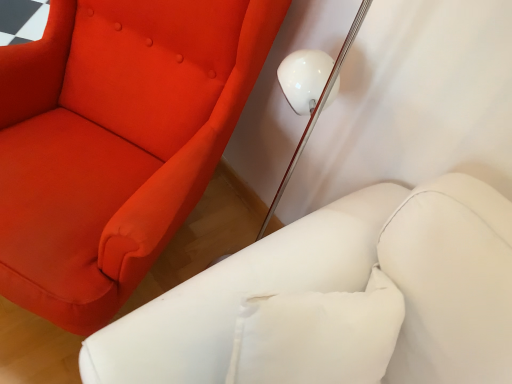
Question: Is matte red fabric chair at upper left taller or shorter than white leather armchair at lower right?

Choices:
 (A) short
 (B) tall

Answer: (B)

Question: Does point [34, 296] appear closer or farther from the camera than point [124, 336]?

Choices:
 (A) closer
 (B) farther

Answer: (B)

Question: From the image's perspective, is matte red fabric chair at upper left located above or below white leather armchair at lower right?

Choices:
 (A) above
 (B) below

Answer: (A)

Question: Choose the correct answer: Is white leather armchair at lower right inside matte red fabric chair at upper left or outside it?

Choices:
 (A) inside
 (B) outside

Answer: (B)

Question: From a real-world perspective, is white leather armchair at lower right physically located above or below matte red fabric chair at upper left?

Choices:
 (A) above
 (B) below

Answer: (A)

Question: Considering the positions of white leather armchair at lower right and matte red fabric chair at upper left in the image, is white leather armchair at lower right wider or thinner than matte red fabric chair at upper left?

Choices:
 (A) thin
 (B) wide

Answer: (A)

Question: From the image's perspective, is white leather armchair at lower right located above or below matte red fabric chair at upper left?

Choices:
 (A) below
 (B) above

Answer: (A)